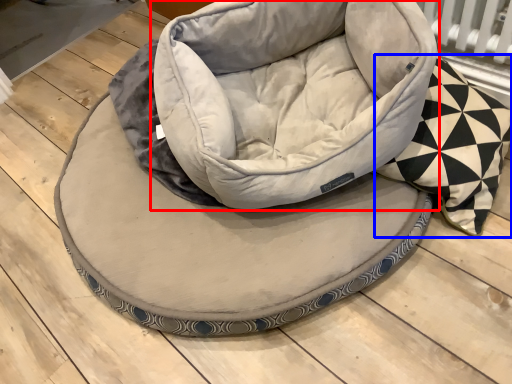
Question: Which point is closer to the camera, bean bag chair (highlighted by a red box) or throw pillow (highlighted by a blue box)?

Choices:
 (A) bean bag chair
 (B) throw pillow

Answer: (B)